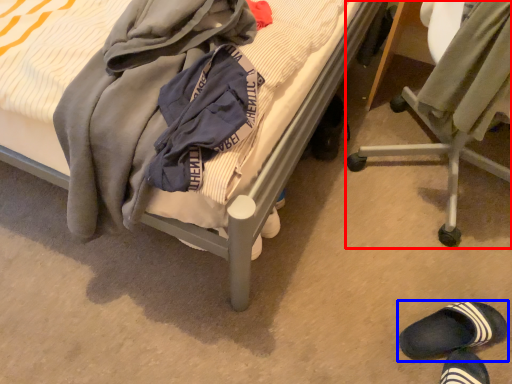
Question: Which object is further to the camera taking this photo, chair (highlighted by a red box) or footwear (highlighted by a blue box)?

Choices:
 (A) chair
 (B) footwear

Answer: (B)